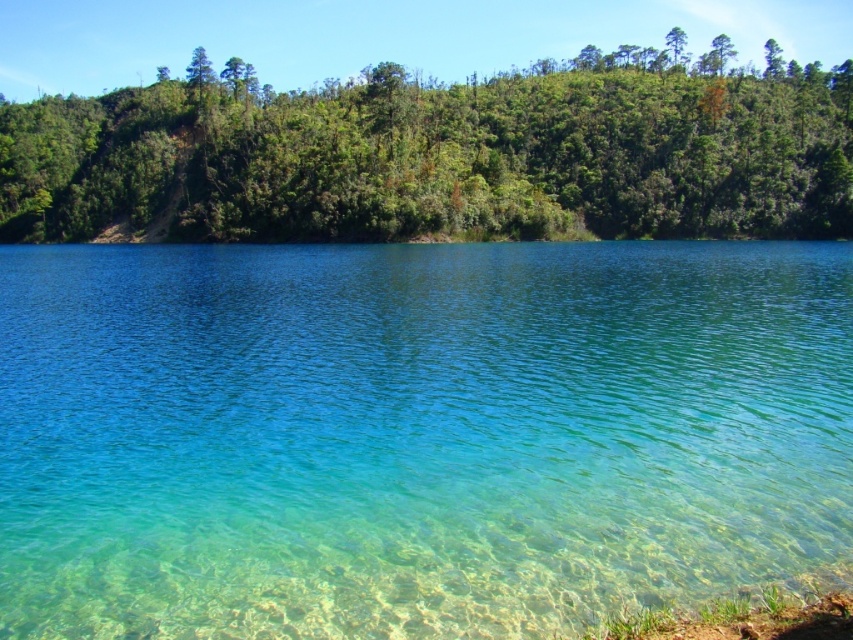
You are standing at the edge of the water and looking towards the hillside. Which of the two green leafy trees, the green leafy trees at upper left or the green leafy tree at upper center, appears closer to you?

The green leafy trees at upper left appears closer because it is smaller than the green leafy tree at upper center.

You are standing at the edge of the clear water at center and want to walk to the green leafy trees at upper left. Which direction should you face to walk directly towards them?

You should face to the left because the clear water at center is positioned on the right side of green leafy trees at upper left, so walking towards the left will lead you directly to them.

You are a photographer planning to capture the clear water at center and the green leafy trees at upper left in a single shot. Based on their sizes in the image, which object would appear smaller in your photograph?

The clear water at center would appear smaller in the photograph because it is smaller than the green leafy trees at upper left according to the description.